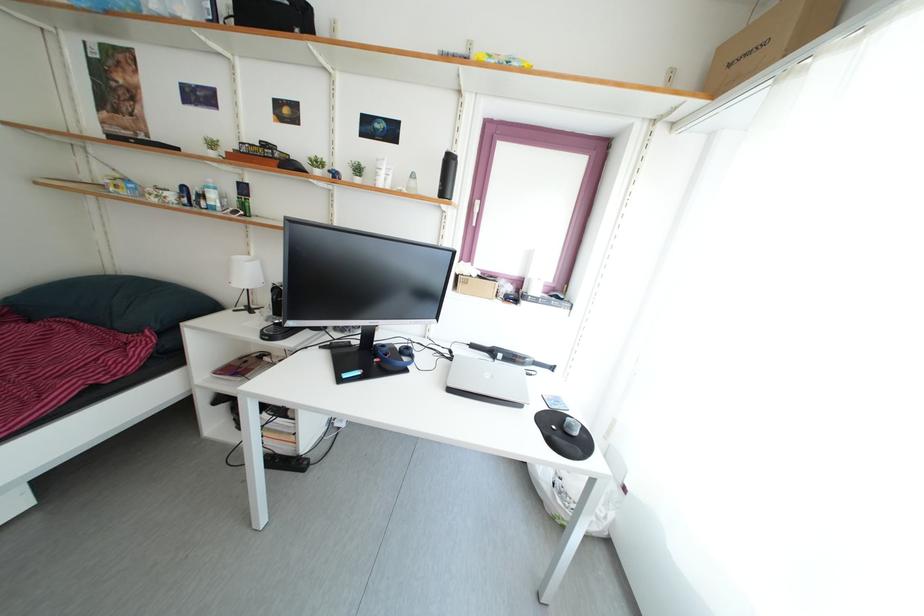
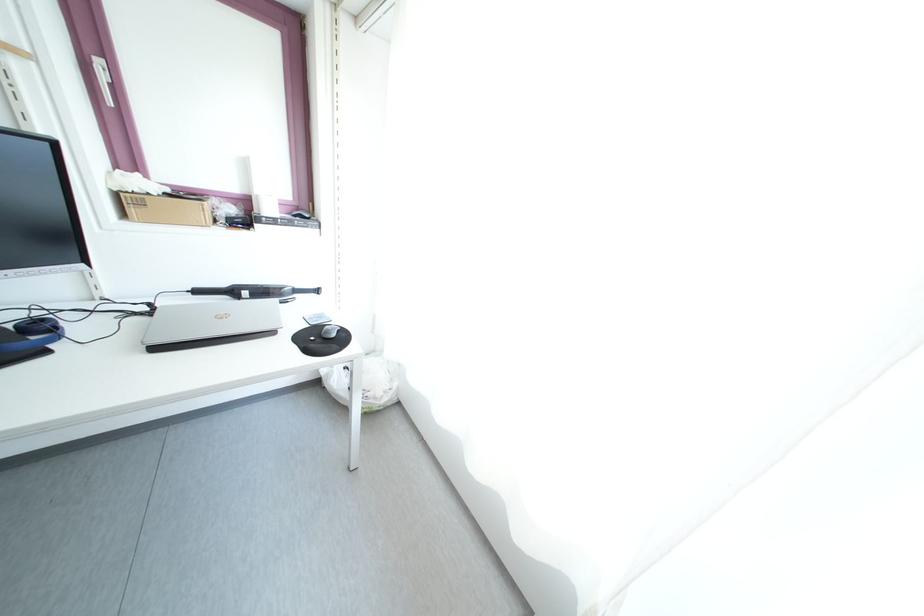
The point at (494,352) is marked in the first image. Where is the corresponding point in the second image?

(229, 293)